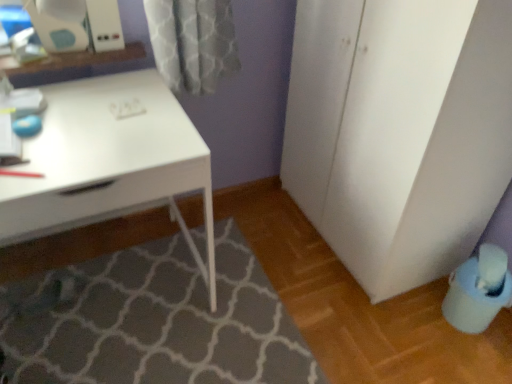
Where is `free point above gray textured bath mat at lower center (from a real-world perspective)`? This screenshot has width=512, height=384. free point above gray textured bath mat at lower center (from a real-world perspective) is located at coordinates (123, 318).